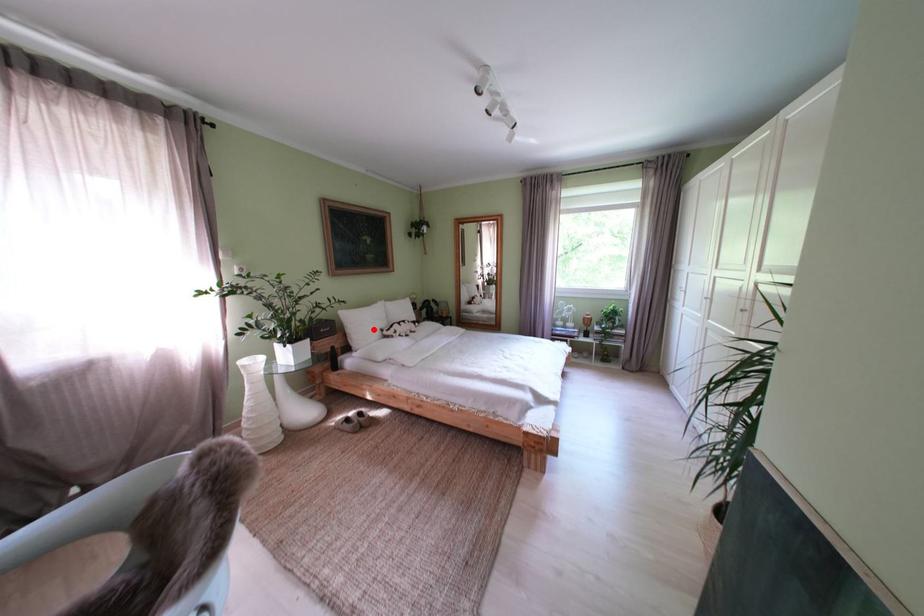
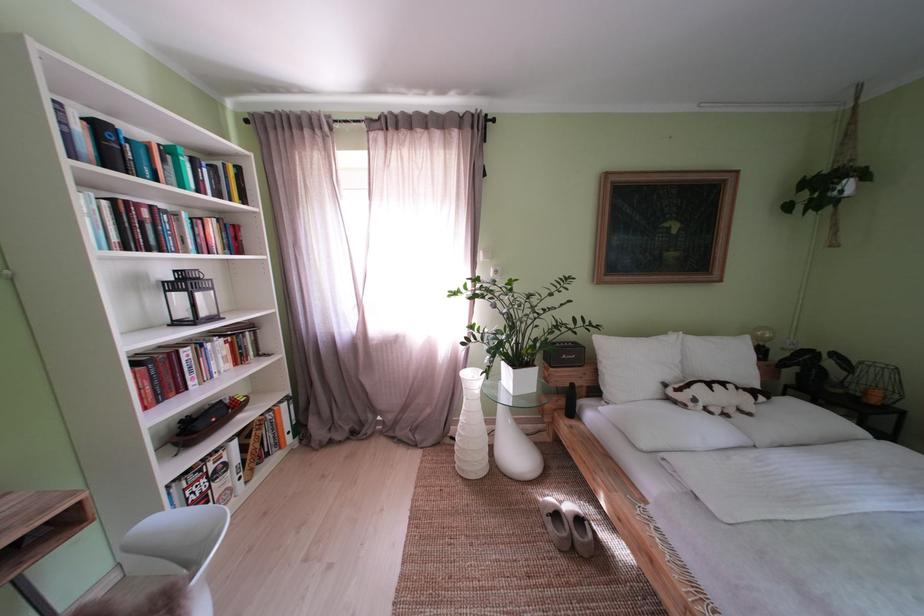
Find the pixel in the second image that matches the highlighted location in the first image.

(639, 369)